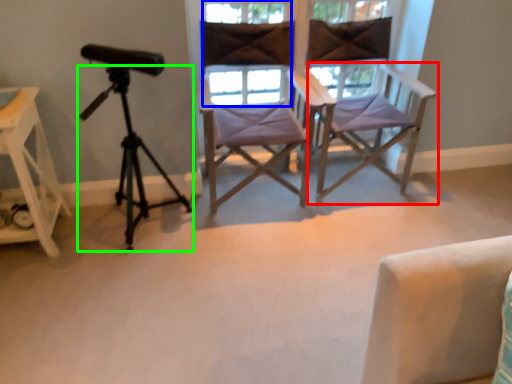
Question: Which object is the farthest from chair (highlighted by a red box)? Choose among these: window (highlighted by a blue box) or tripod (highlighted by a green box).

Choices:
 (A) window
 (B) tripod

Answer: (B)